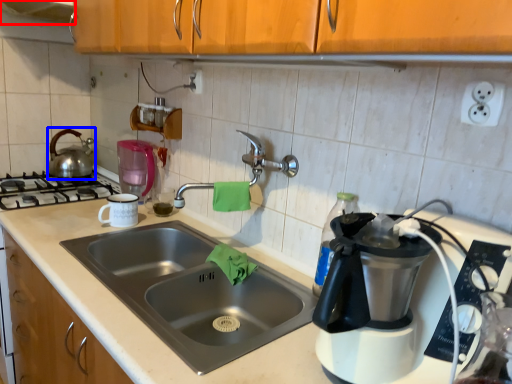
Question: Which object is further to the camera taking this photo, exhaust hood (highlighted by a red box) or tea pot (highlighted by a blue box)?

Choices:
 (A) exhaust hood
 (B) tea pot

Answer: (B)